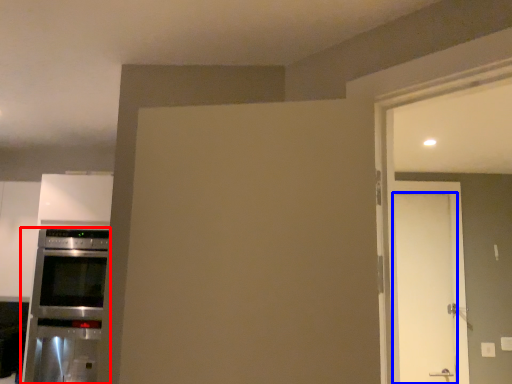
Question: Which point is closer to the camera, home appliance (highlighted by a red box) or door (highlighted by a blue box)?

Choices:
 (A) home appliance
 (B) door

Answer: (A)